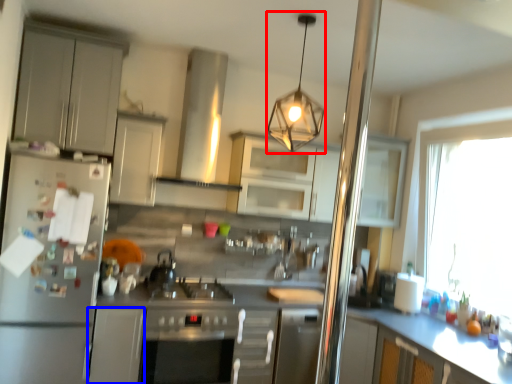
Question: Which of the following is the closest to the observer, light fixture (highlighted by a red box) or cabinetry (highlighted by a blue box)?

Choices:
 (A) light fixture
 (B) cabinetry

Answer: (A)